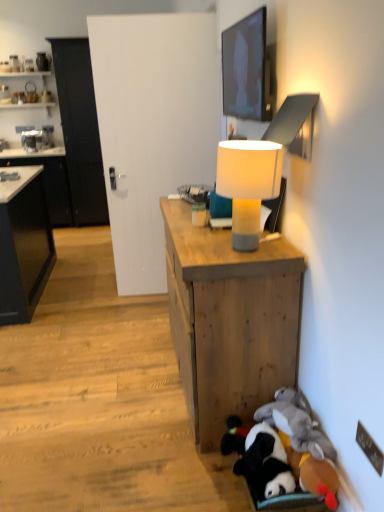
Describe the element at coordinates (248, 184) in the screenshot. The image size is (384, 512). I see `white fabric lampshade at center` at that location.

What do you see at coordinates (80, 130) in the screenshot? I see `black glossy cabinet at left, the 2th cabinetry from the left` at bounding box center [80, 130].

Describe the element at coordinates (283, 451) in the screenshot. I see `fluffy plush toys at lower right` at that location.

What do you see at coordinates (230, 320) in the screenshot? I see `wooden desk at center` at bounding box center [230, 320].

This screenshot has width=384, height=512. I want to click on white fabric lampshade at center, so click(248, 184).

Could you tell me if fluffy plush toys at lower right is facing wooden desk at center?

No, fluffy plush toys at lower right does not turn towards wooden desk at center.

The height and width of the screenshot is (512, 384). Find the location of `stuff located in front of the wooden desk at center`. stuff located in front of the wooden desk at center is located at coordinates (283, 451).

Is fluffy plush toys at lower right next to wooden desk at center and touching it?

No, fluffy plush toys at lower right is not beside wooden desk at center.

From the image's perspective, which is above, fluffy plush toys at lower right or wooden desk at center?

From the image's view, wooden desk at center is above.

Which is in front, black matte cabinet at left, the 2th cabinetry positioned from the right, or wooden desk at center?

wooden desk at center is in front.

Considering the points (44, 170) and (236, 395), which point is in front, point (44, 170) or point (236, 395)?

Point (236, 395)

In terms of height, does black matte cabinet at left, the 2th cabinetry positioned from the right, look taller or shorter compared to wooden desk at center?

In the image, black matte cabinet at left, the 2th cabinetry positioned from the right, appears to be taller than wooden desk at center.

Is wooden desk at center inside the boundaries of black glossy cabinet at left, positioned as the 1th cabinetry in right-to-left order, or outside?

wooden desk at center cannot be found inside black glossy cabinet at left, positioned as the 1th cabinetry in right-to-left order.

Is wooden desk at center thinner than black glossy cabinet at left, positioned as the 1th cabinetry in right-to-left order?

Correct, the width of wooden desk at center is less than that of black glossy cabinet at left, positioned as the 1th cabinetry in right-to-left order.

Considering the relative sizes of wooden desk at center and black glossy cabinet at left, the 2th cabinetry from the left, in the image provided, is wooden desk at center taller than black glossy cabinet at left, the 2th cabinetry from the left,?

No, wooden desk at center is not taller than black glossy cabinet at left, the 2th cabinetry from the left.

Considering the relative sizes of black glossy cabinet at left, positioned as the 1th cabinetry in right-to-left order, and wooden desk at center in the image provided, is black glossy cabinet at left, positioned as the 1th cabinetry in right-to-left order, shorter than wooden desk at center?

In fact, black glossy cabinet at left, positioned as the 1th cabinetry in right-to-left order, may be taller than wooden desk at center.

Which object is further away from the camera, black glossy cabinet at left, the 2th cabinetry from the left, or wooden desk at center?

Positioned behind is black glossy cabinet at left, the 2th cabinetry from the left.

Does black glossy cabinet at left, the 2th cabinetry from the left, touch wooden desk at center?

No, black glossy cabinet at left, the 2th cabinetry from the left, is not next to wooden desk at center.

Does black glossy cabinet at left, positioned as the 1th cabinetry in right-to-left order, have a smaller size compared to wooden desk at center?

Actually, black glossy cabinet at left, positioned as the 1th cabinetry in right-to-left order, might be larger than wooden desk at center.

Between wooden desk at center and fluffy plush toys at lower right, which one has less height?

fluffy plush toys at lower right is shorter.

Locate an element on the screen. Image resolution: width=384 pixels, height=512 pixels. stuff that appears below the wooden desk at center (from the image's perspective) is located at coordinates (283, 451).

Who is more distant, wooden desk at center or fluffy plush toys at lower right?

Positioned behind is wooden desk at center.

From a real-world perspective, between matte black tv at upper center and black matte cabinet at left, marked as the 1th cabinetry in a left-to-right arrangement, who is vertically higher?

matte black tv at upper center.

Is matte black tv at upper center wider or thinner than black matte cabinet at left, the 2th cabinetry positioned from the right?

Clearly, matte black tv at upper center has less width compared to black matte cabinet at left, the 2th cabinetry positioned from the right.

Is matte black tv at upper center touching black matte cabinet at left, the 2th cabinetry positioned from the right?

They are not placed beside each other.

Does black matte cabinet at left, marked as the 1th cabinetry in a left-to-right arrangement, have a greater height compared to black glossy cabinet at left, the 2th cabinetry from the left?

Incorrect, the height of black matte cabinet at left, marked as the 1th cabinetry in a left-to-right arrangement, is not larger of that of black glossy cabinet at left, the 2th cabinetry from the left.

From a real-world perspective, relative to black glossy cabinet at left, the 2th cabinetry from the left, is black matte cabinet at left, the 2th cabinetry positioned from the right, vertically above or below?

black matte cabinet at left, the 2th cabinetry positioned from the right, is below black glossy cabinet at left, the 2th cabinetry from the left.

Based on the photo, is black matte cabinet at left, the 2th cabinetry positioned from the right, not close to black glossy cabinet at left, the 2th cabinetry from the left?

black matte cabinet at left, the 2th cabinetry positioned from the right, is actually quite close to black glossy cabinet at left, the 2th cabinetry from the left.

Find the location of a particular element. cabinetry in front of the black matte cabinet at left, marked as the 1th cabinetry in a left-to-right arrangement is located at coordinates (80, 130).

At what (x,y) coordinates should I click in order to perform the action: click on desk positioned vertically above the fluffy plush toys at lower right (from a real-world perspective). Please return your answer as a coordinate pair (x, y). Looking at the image, I should click on (230, 320).

This screenshot has height=512, width=384. What are the coordinates of `desk on the right of black matte cabinet at left, the 2th cabinetry positioned from the right` in the screenshot? It's located at (230, 320).

Looking at the image, which one is located further to black matte cabinet at left, marked as the 1th cabinetry in a left-to-right arrangement, wooden desk at center or black glossy cabinet at left, positioned as the 1th cabinetry in right-to-left order?

Among the two, wooden desk at center is located further to black matte cabinet at left, marked as the 1th cabinetry in a left-to-right arrangement.

Estimate the real-world distances between objects in this image. Which object is closer to matte black tv at upper center, fluffy plush toys at lower right or white fabric lampshade at center?

white fabric lampshade at center is positioned closer to the anchor matte black tv at upper center.

From the image, which object appears to be farther from wooden desk at center, white fabric lampshade at center or black matte cabinet at left, marked as the 1th cabinetry in a left-to-right arrangement?

The object further to wooden desk at center is black matte cabinet at left, marked as the 1th cabinetry in a left-to-right arrangement.

When comparing their distances from wooden desk at center, does matte black tv at upper center or white fabric lampshade at center seem closer?

Based on the image, white fabric lampshade at center appears to be nearer to wooden desk at center.

From the image, which object appears to be farther from wooden desk at center, black glossy cabinet at left, the 2th cabinetry from the left, or fluffy plush toys at lower right?

black glossy cabinet at left, the 2th cabinetry from the left.

Which object lies nearer to the anchor point wooden desk at center, white fabric lampshade at center or matte black tv at upper center?

white fabric lampshade at center.

Which object lies nearer to the anchor point black matte cabinet at left, marked as the 1th cabinetry in a left-to-right arrangement, fluffy plush toys at lower right or white fabric lampshade at center?

white fabric lampshade at center is closer to black matte cabinet at left, marked as the 1th cabinetry in a left-to-right arrangement.

Considering their positions, is black glossy cabinet at left, the 2th cabinetry from the left, positioned closer to black matte cabinet at left, the 2th cabinetry positioned from the right, than fluffy plush toys at lower right?

black glossy cabinet at left, the 2th cabinetry from the left, is closer to black matte cabinet at left, the 2th cabinetry positioned from the right.

Identify the location of cabinetry between wooden desk at center and black matte cabinet at left, marked as the 1th cabinetry in a left-to-right arrangement, along the z-axis. The width and height of the screenshot is (384, 512). (80, 130).

Locate an element on the screen. lamp between fluffy plush toys at lower right and black glossy cabinet at left, the 2th cabinetry from the left, in the front-back direction is located at coordinates (248, 184).

Where is `desk between white fabric lampshade at center and black glossy cabinet at left, the 2th cabinetry from the left, along the z-axis`? desk between white fabric lampshade at center and black glossy cabinet at left, the 2th cabinetry from the left, along the z-axis is located at coordinates (230, 320).

Image resolution: width=384 pixels, height=512 pixels. I want to click on desk between fluffy plush toys at lower right and black glossy cabinet at left, positioned as the 1th cabinetry in right-to-left order, in the front-back direction, so click(230, 320).